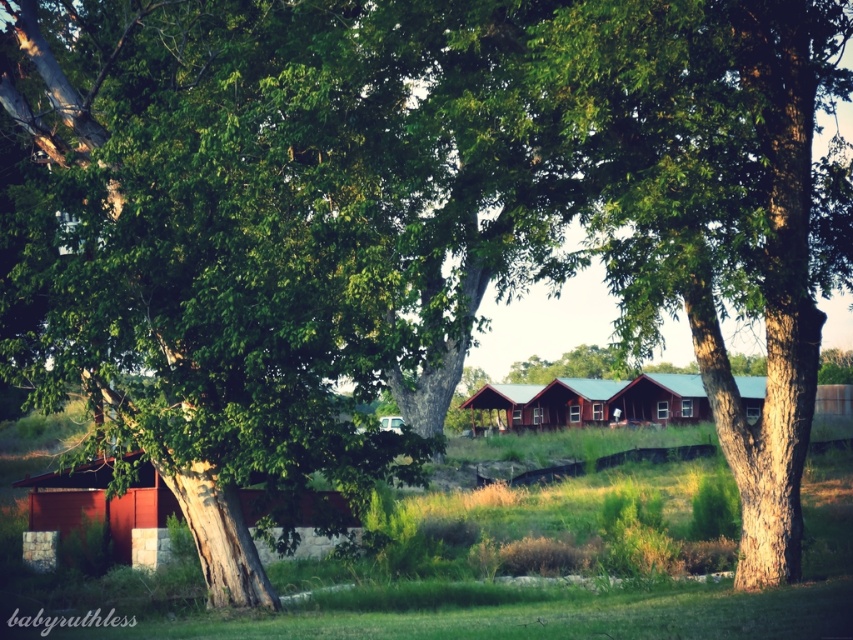
You are standing in the middle of the grassy area and want to walk to the nearest cabin. Which cabin should you head towards, the matte red cabin at lower left or the metallic red cabin at center?

You should head towards the matte red cabin at lower left because it is closer to the viewer than the metallic red cabin at center.

You are standing in the middle of the grassy area and want to walk to the green wooden cabin at center. Which direction should you walk to avoid passing the matte red cabin at lower left?

Since the matte red cabin at lower left is to the left of the green wooden cabin at center, you should walk straight ahead towards the green wooden cabin at center to avoid passing the matte red cabin at lower left.

You are standing in the middle of the grassy area and see both the matte red cabin at lower left and the metallic red cabin at center. Which cabin is closer to your current position?

The metallic red cabin at center is closer to your current position because it is located at the center, while the matte red cabin at lower left is positioned to the left of it, making it farther away.